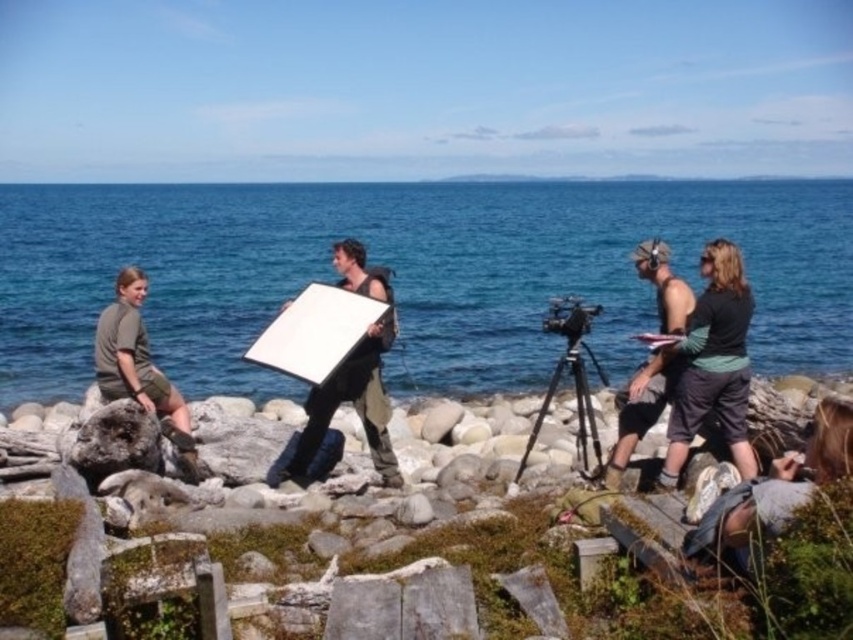
Question: Is blue water at center smaller than matte white board at center?

Choices:
 (A) no
 (B) yes

Answer: (A)

Question: From the image, what is the correct spatial relationship of matte black shirt at right in relation to black metal tripod at center?

Choices:
 (A) below
 (B) above

Answer: (B)

Question: In this image, where is blue water at center located relative to black metal tripod at center?

Choices:
 (A) right
 (B) left

Answer: (B)

Question: Estimate the real-world distances between objects in this image. Which object is closer to the matte black shirt at right?

Choices:
 (A) black metal tripod at center
 (B) blue water at center

Answer: (A)

Question: Among these points, which one is farthest from the camera?

Choices:
 (A) (795, 355)
 (B) (727, 252)
 (C) (163, 394)
 (D) (833, 410)

Answer: (A)

Question: Which point is closer to the camera taking this photo?

Choices:
 (A) (665, 262)
 (B) (187, 417)
 (C) (813, 428)
 (D) (732, 380)

Answer: (C)